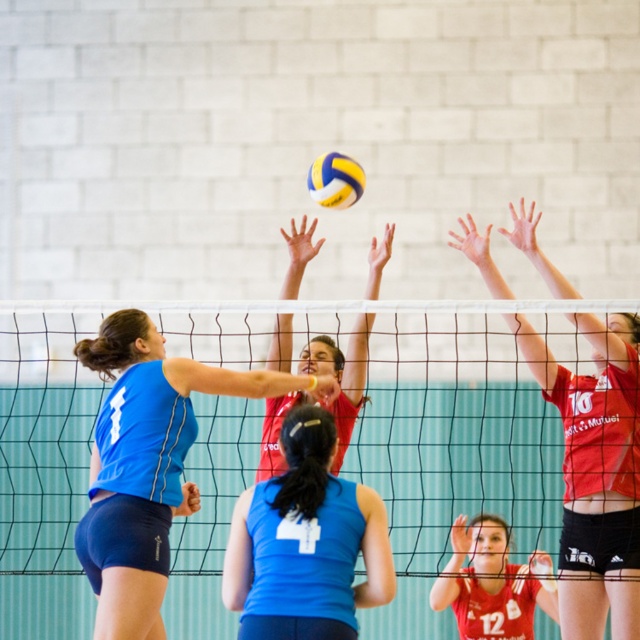
You are a spectator at the volleyball game. You notice the blue matte tank top at center and the matte red volleyball at center. Which object is closer to the net?

The blue matte tank top at center is positioned under the matte red volleyball at center, meaning it is closer to the net.